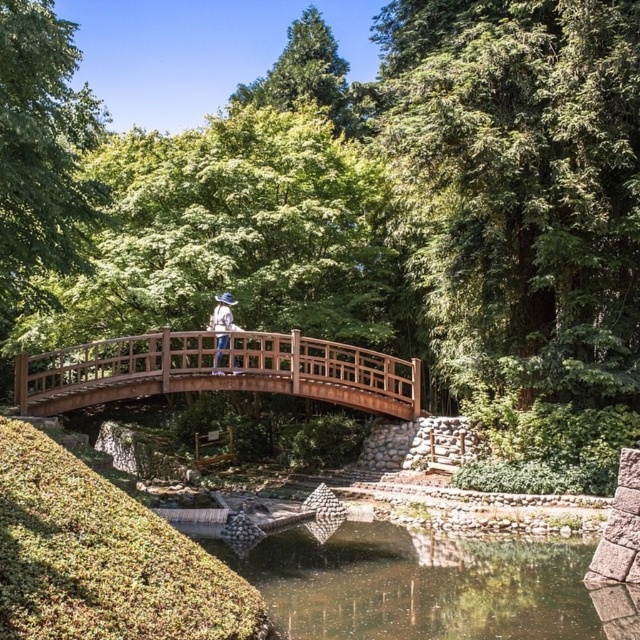
Which is more to the right, clear water at center or wooden bridge at center?

clear water at center

Is clear water at center positioned behind wooden bridge at center?

No.

The image size is (640, 640). In order to click on clear water at center in this screenshot , I will do click(x=422, y=582).

Who is more forward, [198,376] or [218,352]?

Point [198,376] is in front.

In order to click on wooden bridge at center in this screenshot , I will do `click(216, 374)`.

Describe the element at coordinates (422, 582) in the screenshot. This screenshot has height=640, width=640. I see `clear water at center` at that location.

Can you confirm if clear water at center is positioned below green mossy rock at lower left?

Indeed, clear water at center is positioned under green mossy rock at lower left.

Does point (554, 634) come closer to viewer compared to point (180, 596)?

That is False.

Locate an element on the screen. Image resolution: width=640 pixels, height=640 pixels. clear water at center is located at coordinates (422, 582).